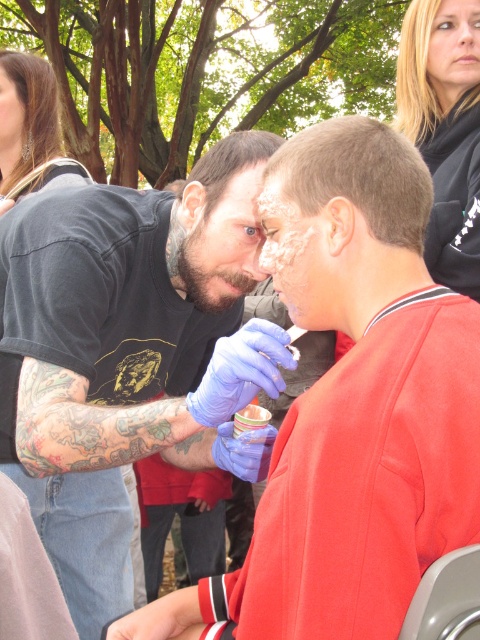
Can you confirm if blue latex gloves at center is smaller than white matte face paint at center?

Actually, blue latex gloves at center might be larger than white matte face paint at center.

Is blue latex gloves at center positioned before white matte face paint at center?

Yes, blue latex gloves at center is in front of white matte face paint at center.

Locate an element on the screen. The image size is (480, 640). blue latex gloves at center is located at coordinates (129, 353).

The height and width of the screenshot is (640, 480). In order to click on blue latex gloves at center in this screenshot , I will do `click(129, 353)`.

Can you confirm if blue latex gloves at upper left is positioned to the right of blonde hair at upper right?

No, blue latex gloves at upper left is not to the right of blonde hair at upper right.

Is blue latex gloves at upper left below blonde hair at upper right?

Yes.

Who is more distant from viewer, (x=337, y=301) or (x=432, y=140)?

The point (x=432, y=140) is behind.

Image resolution: width=480 pixels, height=640 pixels. I want to click on blue latex gloves at upper left, so click(x=351, y=406).

Is white matte face paint at center closer to the viewer compared to smooth skin face at center?

Yes, it is in front of smooth skin face at center.

Which is above, white matte face paint at center or smooth skin face at center?

smooth skin face at center

This screenshot has width=480, height=640. What are the coordinates of `white matte face paint at center` in the screenshot? It's located at (285, 248).